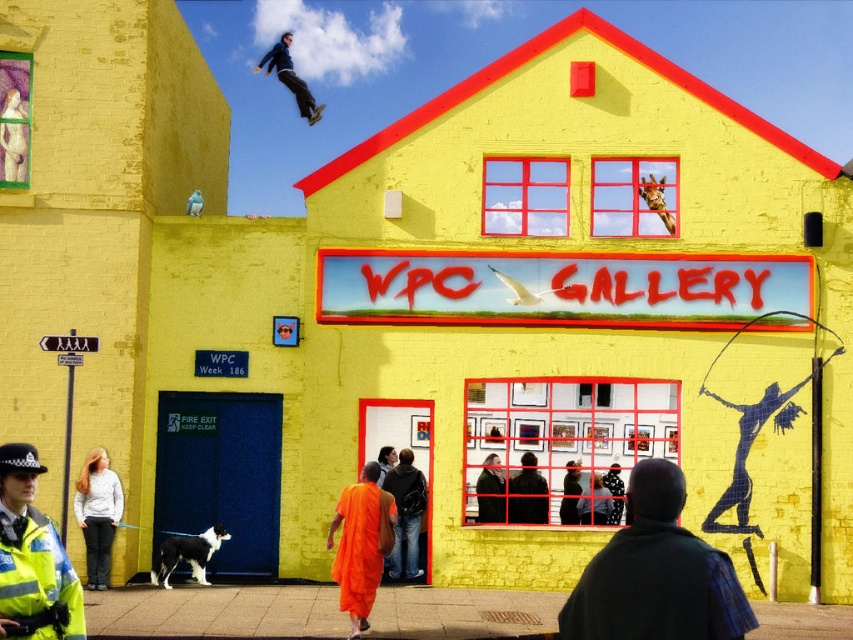
Question: Which object appears farthest from the camera in this image?

Choices:
 (A) dark blue fabric at lower right
 (B) blue smooth skateboard at upper center

Answer: (B)

Question: Does dark blue fabric at lower right appear on the right side of light gray sweater at lower left?

Choices:
 (A) yes
 (B) no

Answer: (A)

Question: Can you confirm if reflective blue uniform at lower left is positioned to the right of blue smooth skateboard at upper center?

Choices:
 (A) yes
 (B) no

Answer: (A)

Question: Based on their relative distances, which object is farther from the light gray sweater at lower left?

Choices:
 (A) orange fabric man at center
 (B) reflective blue uniform at lower left

Answer: (B)

Question: Which point is farther to the camera?

Choices:
 (A) (38, 474)
 (B) (283, 81)
 (C) (88, 465)
 (D) (409, 480)

Answer: (B)

Question: From the image, what is the correct spatial relationship of light gray sweater at lower left in relation to blue smooth skateboard at upper center?

Choices:
 (A) right
 (B) left

Answer: (B)